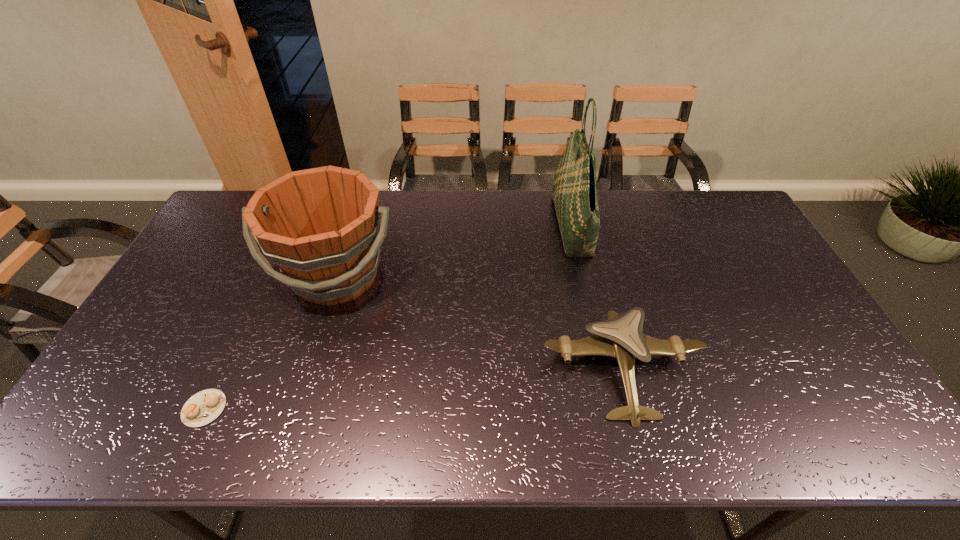
I want to click on free space that is in between the tallest object and the bucket, so click(x=454, y=251).

Locate an element on the screen. unoccupied position between the second tallest object and the drone is located at coordinates (479, 322).

Image resolution: width=960 pixels, height=540 pixels. What are the coordinates of `unoccupied area between the shortest object and the tote bag` in the screenshot? It's located at (388, 317).

Locate an element on the screen. vacant region between the third shortest object and the tallest object is located at coordinates (454, 251).

The height and width of the screenshot is (540, 960). Find the location of `object that stands as the closest to the bucket`. object that stands as the closest to the bucket is located at coordinates (205, 406).

Identify which object is located as the second nearest to the bucket. Please provide its 2D coordinates. Your answer should be formatted as a tuple, i.e. [(x, y)], where the tuple contains the x and y coordinates of a point satisfying the conditions above.

[(622, 337)]